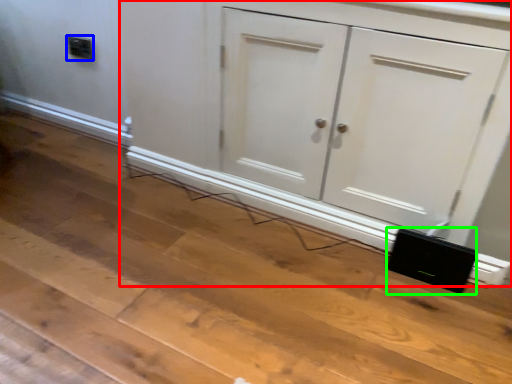
Question: Considering the real-world distances, which object is closest to cupboard (highlighted by a red box)? electric outlet (highlighted by a blue box) or speaker (highlighted by a green box).

Choices:
 (A) electric outlet
 (B) speaker

Answer: (B)